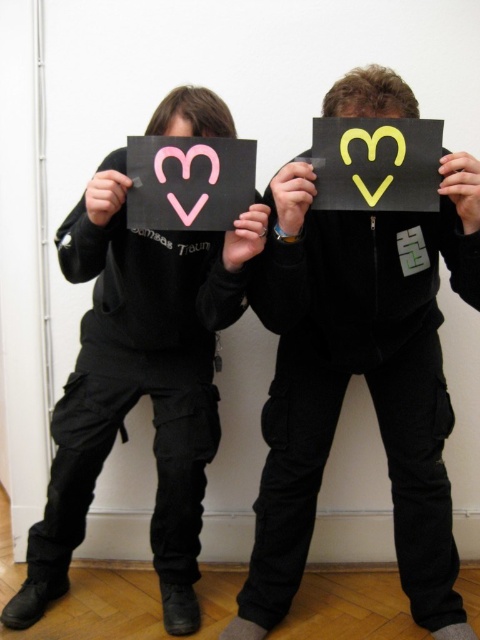
Question: Which object appears farthest from the camera in this image?

Choices:
 (A) yellow matte heart at center
 (B) pink matte heart at upper left

Answer: (B)

Question: Which point is closer to the camera taking this photo?

Choices:
 (A) (215, 129)
 (B) (163, 160)

Answer: (B)

Question: Considering the relative positions of pink matte heart at center and matte black hair at upper center in the image provided, where is pink matte heart at center located with respect to matte black hair at upper center?

Choices:
 (A) below
 (B) above

Answer: (A)

Question: Which point is closer to the camera?

Choices:
 (A) pink matte heart at center
 (B) yellow matte heart at center
 (C) matte black hair at upper center

Answer: (B)

Question: Is yellow matte heart at center closer to the viewer compared to pink matte heart at upper left?

Choices:
 (A) yes
 (B) no

Answer: (A)

Question: Is yellow matte heart at center in front of pink matte heart at upper left?

Choices:
 (A) no
 (B) yes

Answer: (B)